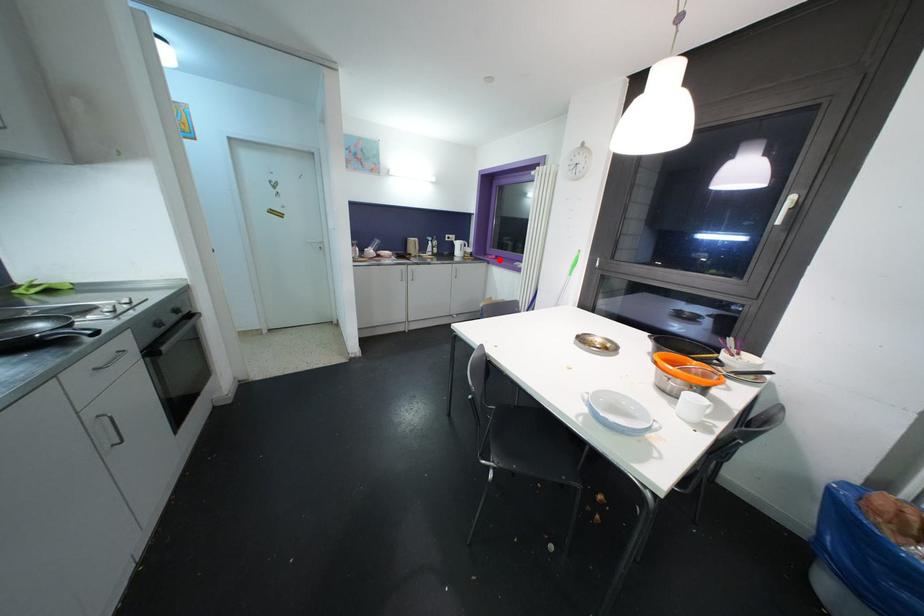
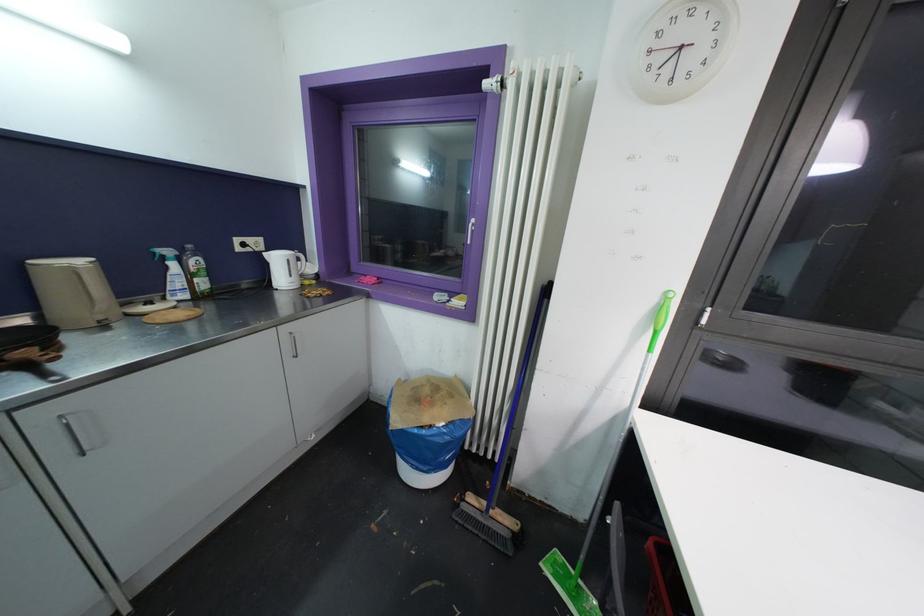
Locate, in the second image, the point that corresponds to the highlighted location in the first image.

(383, 284)